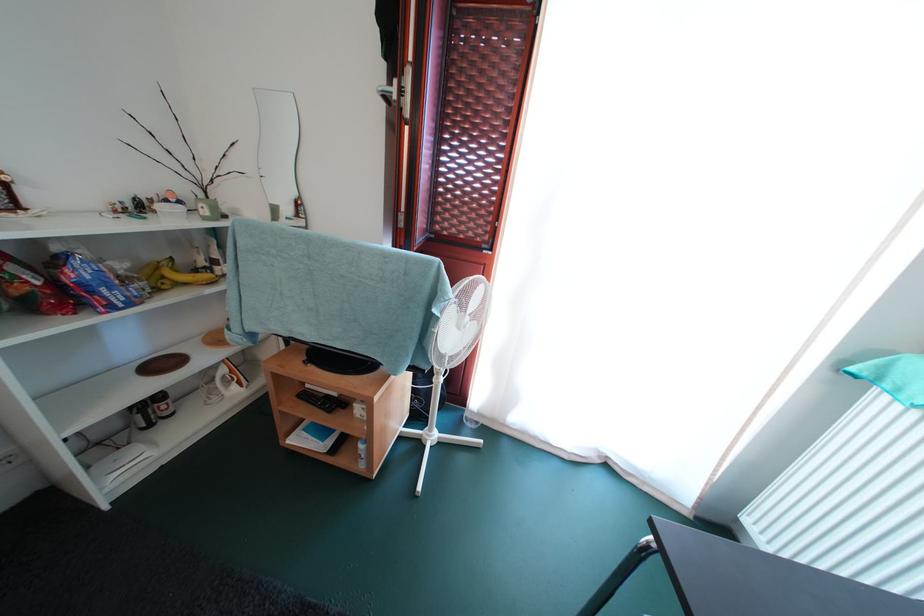
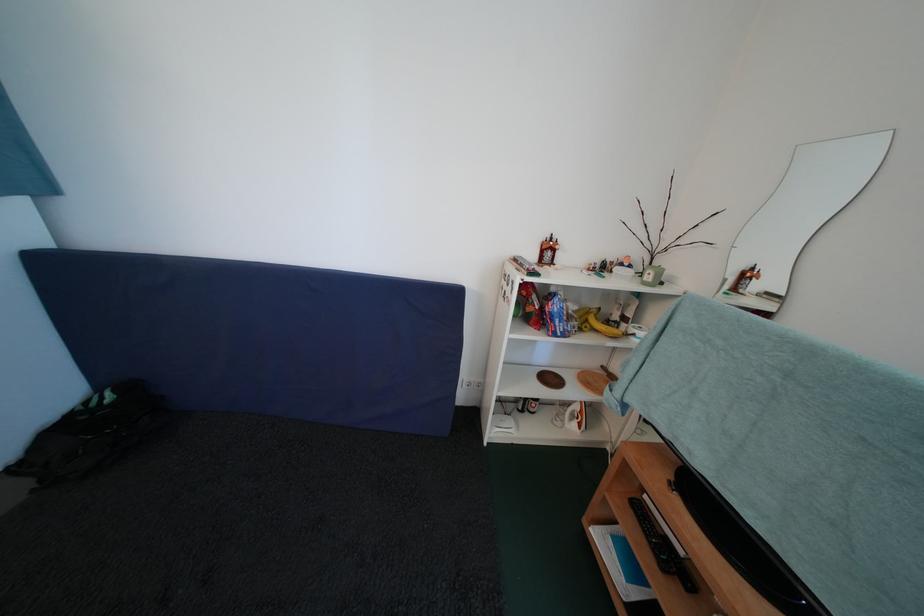
Locate, in the second image, the point that corresponds to pixel 229 376 in the first image.

(584, 411)